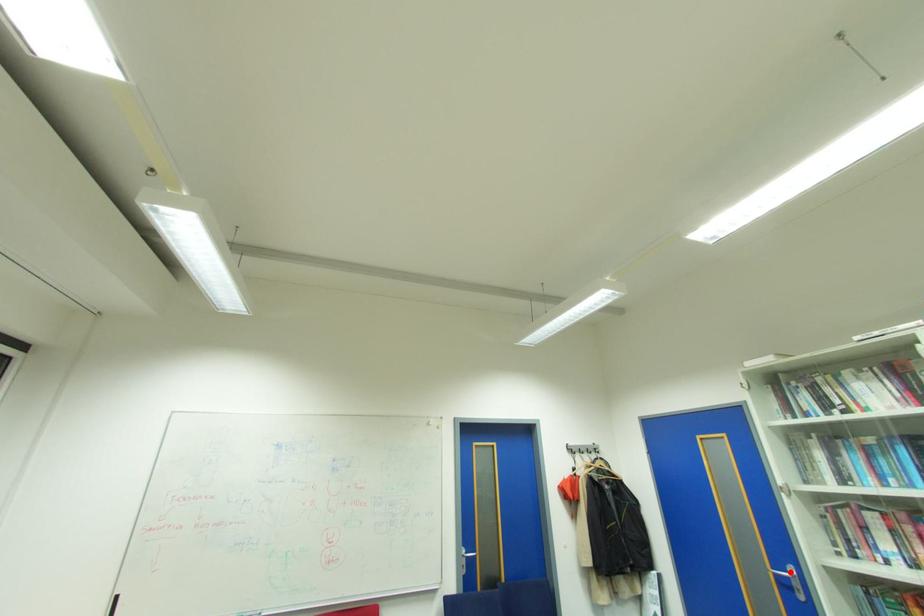
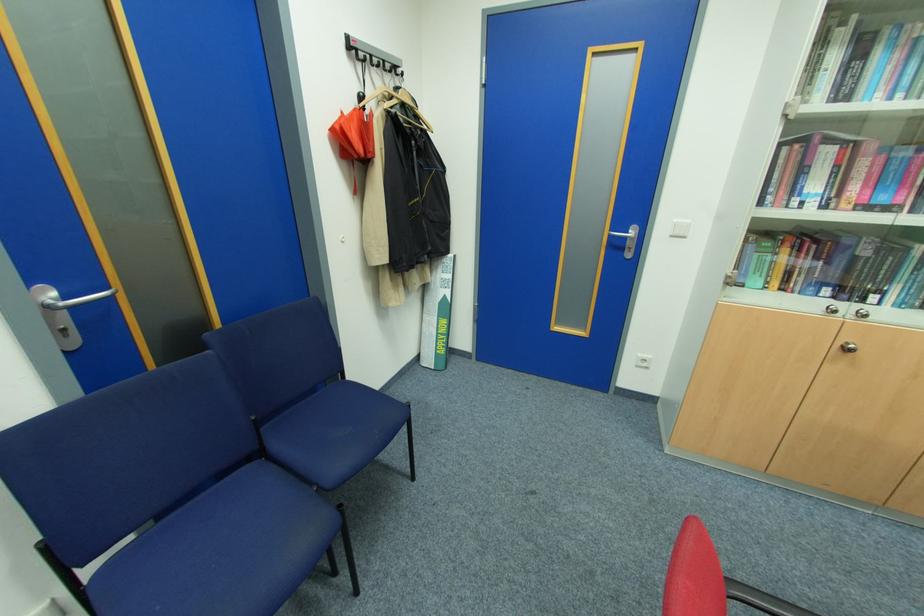
Question: A red point is marked in image1. In image2, is the corresponding 3D point closer to the camera or farther? Reply with the corresponding letter.

Choices:
 (A) The corresponding 3D point is closer.
 (B) The corresponding 3D point is farther.

Answer: (B)